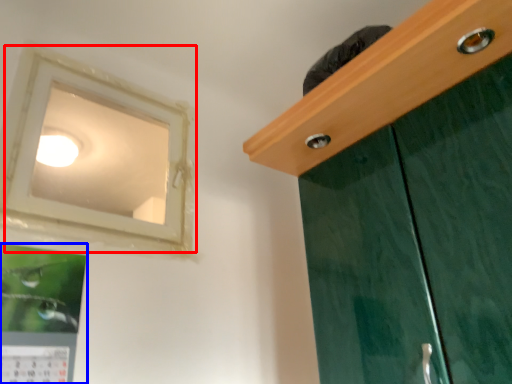
Question: Which of the following is the farthest to the observer, window (highlighted by a red box) or picture frame (highlighted by a blue box)?

Choices:
 (A) window
 (B) picture frame

Answer: (A)